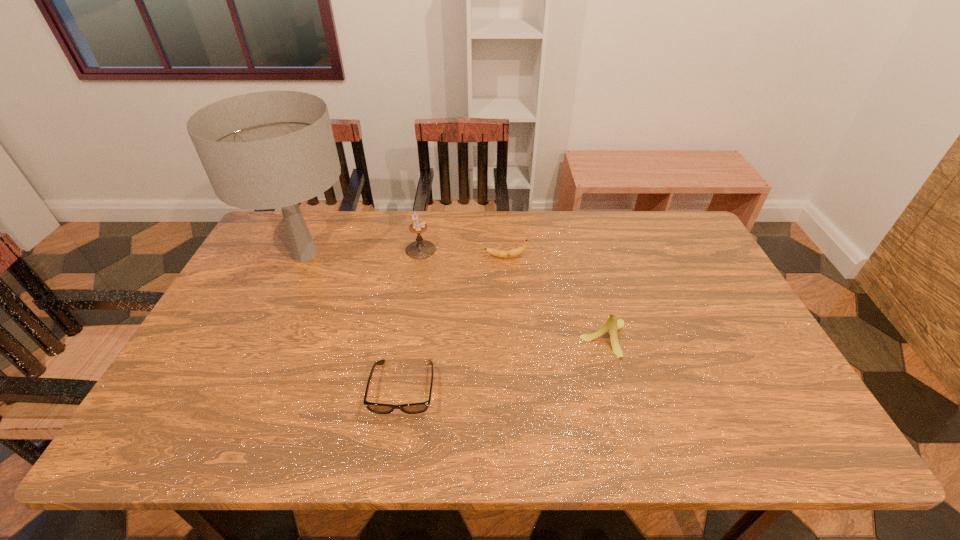
Where is `vacant region located 0.340m on the front of the second tallest object`? This screenshot has width=960, height=540. vacant region located 0.340m on the front of the second tallest object is located at coordinates (406, 342).

Where is `vacant space located 0.080m on the back of the nearer banana`? The width and height of the screenshot is (960, 540). vacant space located 0.080m on the back of the nearer banana is located at coordinates (594, 299).

Image resolution: width=960 pixels, height=540 pixels. What are the coordinates of `vacant space situated 0.380m on the peel of the fourth object from left to right from the top` in the screenshot? It's located at (367, 257).

Find the location of a particular element. The height and width of the screenshot is (540, 960). vacant space located 0.110m on the peel of the fourth object from left to right from the top is located at coordinates (450, 257).

You are a GUI agent. You are given a task and a screenshot of the screen. Output one action in this format:
    pyautogui.click(x=<x>, y=<y>)
    Task: Click on the free space located 0.390m on the peel of the fourth object from left to right from the top
    The height and width of the screenshot is (540, 960).
    Given the screenshot: What is the action you would take?
    pyautogui.click(x=364, y=257)

Identify the location of vacant area situated on the lenses of the spectacles. The image size is (960, 540). (395, 450).

At what (x,y) coordinates should I click in order to perform the action: click on lampshade at the far edge. Please return your answer as a coordinate pair (x, y). Looking at the image, I should click on (x=272, y=149).

At what (x,y) coordinates should I click in order to perform the action: click on candle holder at the far edge. Please return your answer as a coordinate pair (x, y). Looking at the image, I should click on (419, 249).

This screenshot has width=960, height=540. What are the coordinates of `object situated at the near edge` in the screenshot? It's located at (414, 408).

I want to click on object that is at the left edge, so click(272, 149).